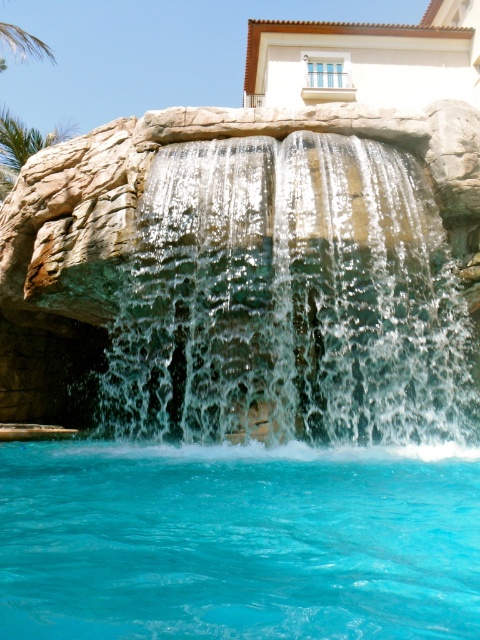
From the picture: Is clear water cascade at center in front of turquoise glossy water at lower center?

No, it is behind turquoise glossy water at lower center.

Between point (442, 234) and point (59, 634), which one is positioned in front?

Point (59, 634)

Who is more forward, (330,248) or (109,637)?

Point (109,637)

Identify the location of clear water cascade at center. (288, 300).